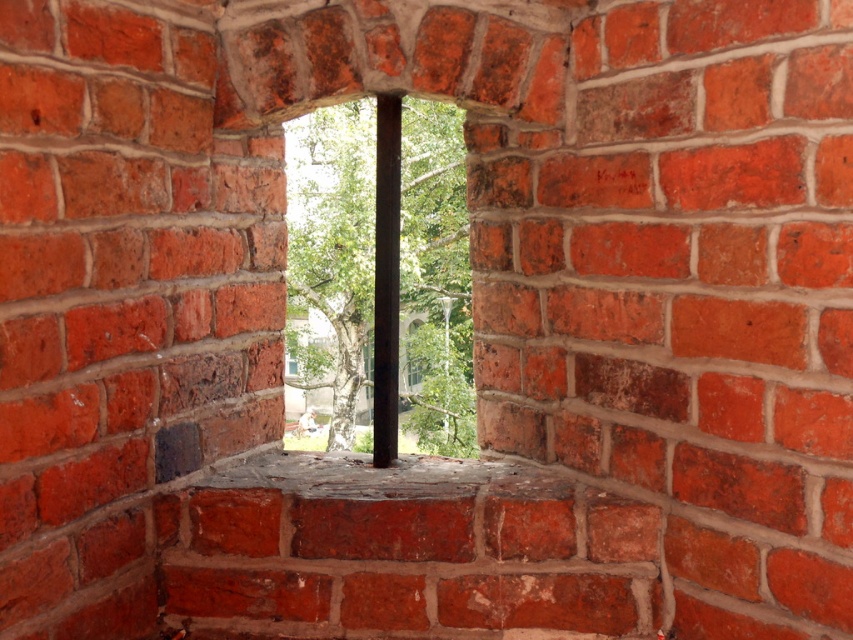
Does point (426, 136) come behind point (198, 461)?

Yes, point (426, 136) is behind point (198, 461).

Does transparent glass window at center have a smaller size compared to metallic gray hole at lower left?

Incorrect, transparent glass window at center is not smaller in size than metallic gray hole at lower left.

Who is more forward, (x=340, y=364) or (x=200, y=442)?

Point (x=200, y=442) is more forward.

Image resolution: width=853 pixels, height=640 pixels. In order to click on transparent glass window at center in this screenshot , I will do `click(334, 260)`.